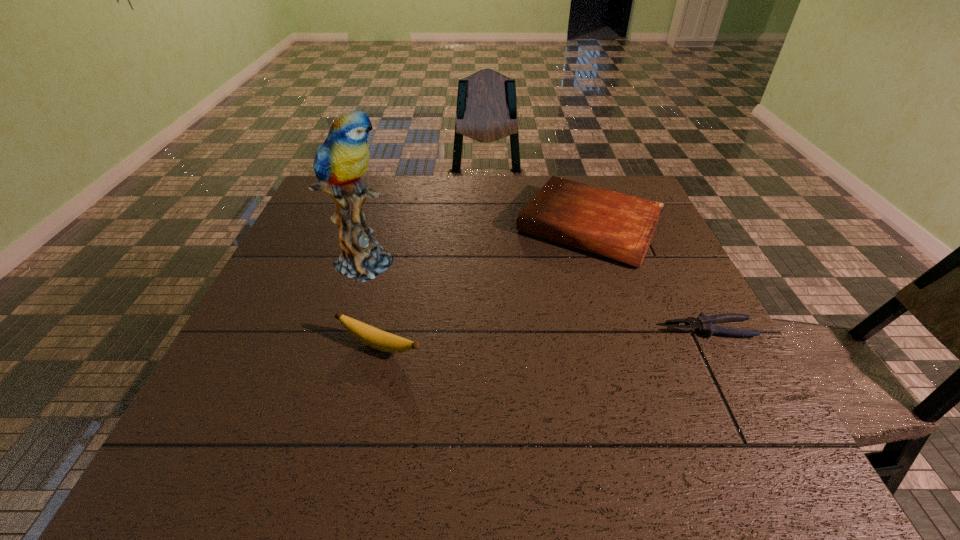
The height and width of the screenshot is (540, 960). What are the coordinates of `vacant region between the Bible and the banana` in the screenshot? It's located at coord(485,287).

Image resolution: width=960 pixels, height=540 pixels. Identify the location of vacant point located between the parrot and the banana. (373, 303).

Identify the location of vacant space that's between the Bible and the banana. The height and width of the screenshot is (540, 960). (485, 287).

Where is `vacant area that lies between the banana and the shortest object`? The width and height of the screenshot is (960, 540). vacant area that lies between the banana and the shortest object is located at coordinates (544, 338).

In order to click on blank region between the parrot and the banana in this screenshot , I will do `click(373, 303)`.

In order to click on the second closest object relative to the banana in this screenshot , I will do `click(618, 226)`.

Locate an element on the screen. object that ranks as the third closest to the tallest object is located at coordinates [x=705, y=324].

You are a GUI agent. You are given a task and a screenshot of the screen. Output one action in this format:
    pyautogui.click(x=<x>, y=<y>)
    Task: Click on the vacant space that satisfies the following two spatial constraints: 1. on the back side of the tallest object; 2. on the right side of the Bible
    The height and width of the screenshot is (540, 960).
    Given the screenshot: What is the action you would take?
    pyautogui.click(x=377, y=227)

Find the location of a particular element. free space that satisfies the following two spatial constraints: 1. on the back side of the tallest object; 2. on the left side of the Bible is located at coordinates (377, 227).

Where is `vacant point that satisfies the following two spatial constraints: 1. on the back side of the shortest object; 2. at the gripping part of the banana`? vacant point that satisfies the following two spatial constraints: 1. on the back side of the shortest object; 2. at the gripping part of the banana is located at coordinates [383, 329].